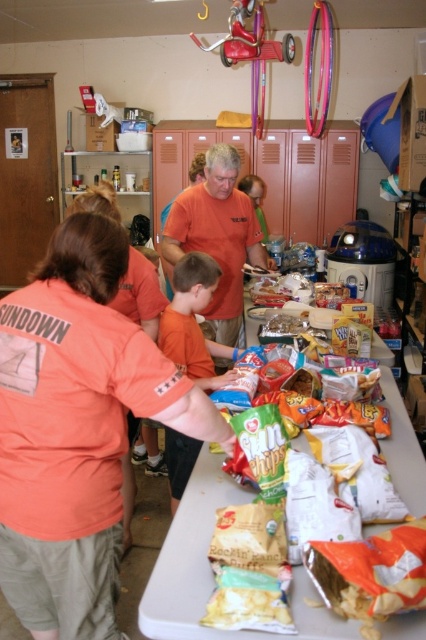
Does point (169, 548) come in front of point (238, 321)?

Yes, point (169, 548) is closer to viewer.

How much distance is there between white plastic table at center and orange cotton shirt at center?

A distance of 1.45 meters exists between white plastic table at center and orange cotton shirt at center.

Find the location of a particular element. white plastic table at center is located at coordinates (190, 561).

Where is `white plastic table at center`? The width and height of the screenshot is (426, 640). white plastic table at center is located at coordinates (190, 561).